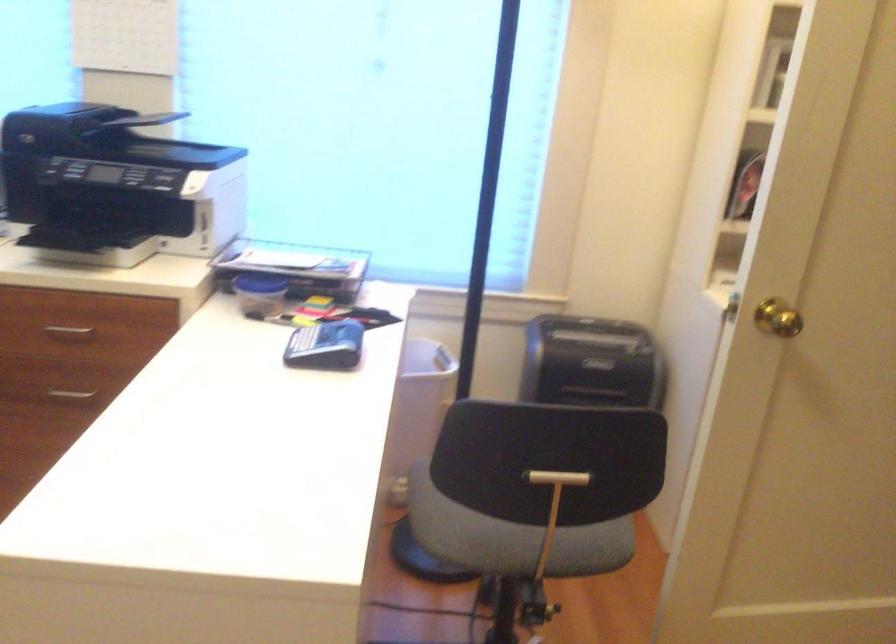
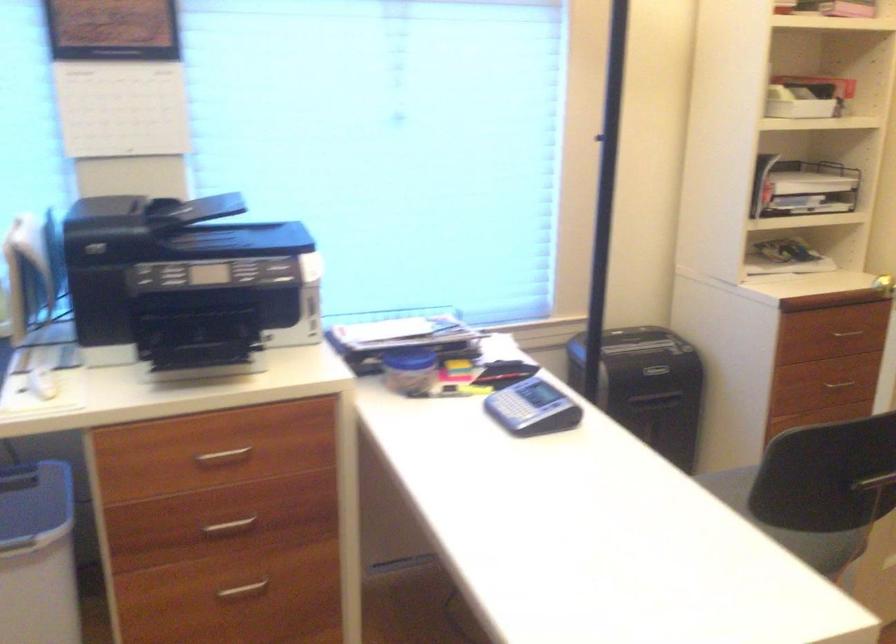
Question: The camera is either moving clockwise (left) or counter-clockwise (right) around the object. The first image is from the beginning of the video and the second image is from the end. Is the camera moving left or right when shooting the video?

Choices:
 (A) Left
 (B) Right

Answer: (A)